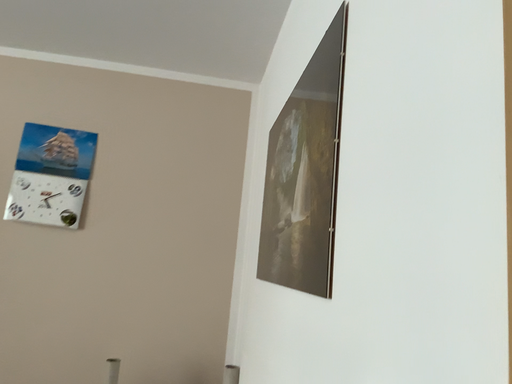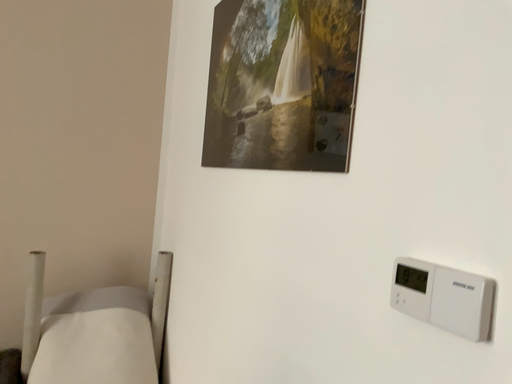
Question: How did the camera likely rotate when shooting the video?

Choices:
 (A) rotated upward
 (B) rotated downward

Answer: (B)